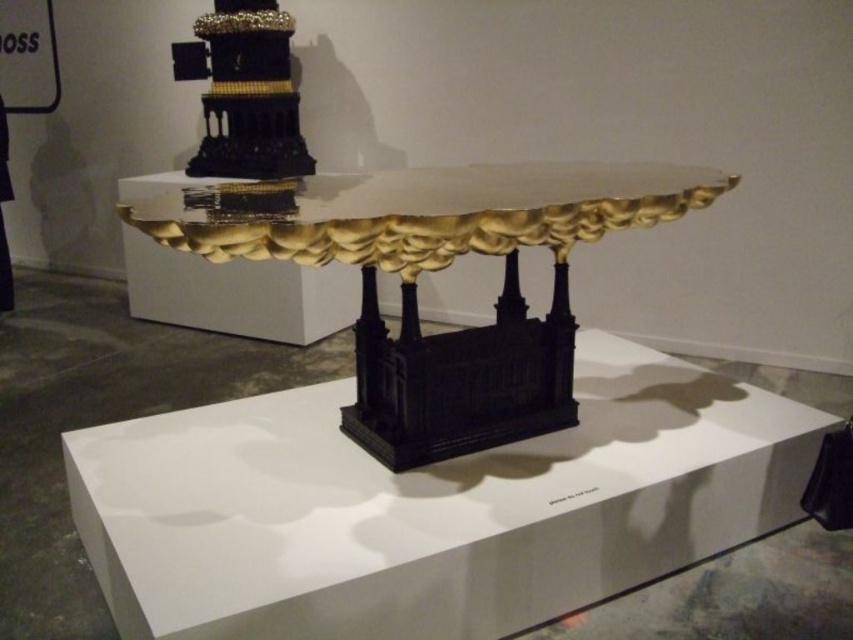
Question: Does black glossy table at center appear on the left side of gold glossy table at center?

Choices:
 (A) no
 (B) yes

Answer: (B)

Question: Which point is closer to the camera?

Choices:
 (A) gold textured tower at upper center
 (B) black glossy table at center

Answer: (B)

Question: Among these points, which one is farthest from the camera?

Choices:
 (A) (628, 538)
 (B) (425, 236)
 (C) (288, 38)

Answer: (C)

Question: Does black glossy table at center lie behind gold textured tower at upper center?

Choices:
 (A) yes
 (B) no

Answer: (B)

Question: Can you confirm if gold glossy table at center is positioned to the left of gold textured tower at upper center?

Choices:
 (A) yes
 (B) no

Answer: (B)

Question: Estimate the real-world distances between objects in this image. Which object is farther from the gold glossy table at center?

Choices:
 (A) gold textured tower at upper center
 (B) black glossy table at center

Answer: (A)